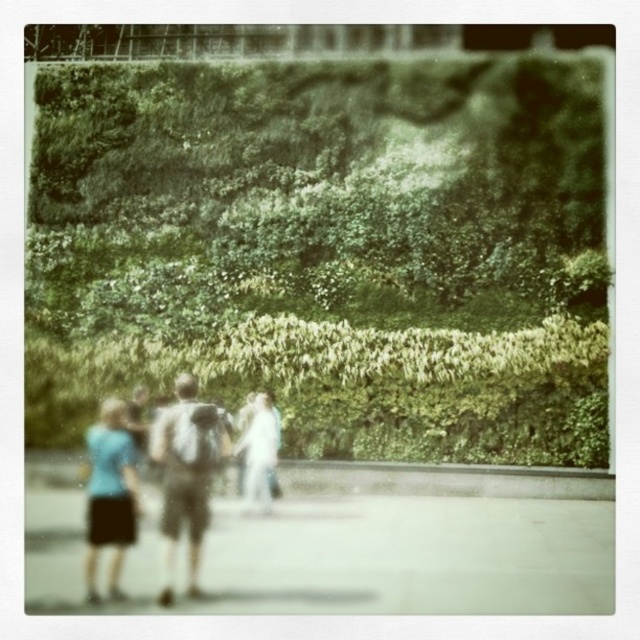
Can you confirm if gray concrete pavement at lower center is positioned to the right of light blue fabric couple at center?

Yes, gray concrete pavement at lower center is to the right of light blue fabric couple at center.

Does gray concrete pavement at lower center come in front of light blue fabric couple at center?

Yes, gray concrete pavement at lower center is closer to the viewer.

Between point (257, 525) and point (195, 410), which one is positioned in front?

Point (195, 410) is more forward.

The image size is (640, 640). I want to click on gray concrete pavement at lower center, so click(x=410, y=556).

Which is more to the right, green leafy hedge at upper center or light blue fabric skirt at lower left?

Positioned to the right is green leafy hedge at upper center.

Is point (102, 253) in front of point (93, 440)?

No, it is not.

Between point (612, 394) and point (125, 547), which one is positioned behind?

Point (612, 394)

Where is `green leafy hedge at upper center`? This screenshot has width=640, height=640. green leafy hedge at upper center is located at coordinates click(x=332, y=248).

The width and height of the screenshot is (640, 640). What do you see at coordinates (186, 474) in the screenshot?
I see `light blue fabric couple at center` at bounding box center [186, 474].

Between light blue fabric couple at center and gray fabric backpack at center, which one has more height?

With more height is gray fabric backpack at center.

Who is more forward, (172, 515) or (179, 403)?

Positioned in front is point (172, 515).

I want to click on light blue fabric couple at center, so click(x=186, y=474).